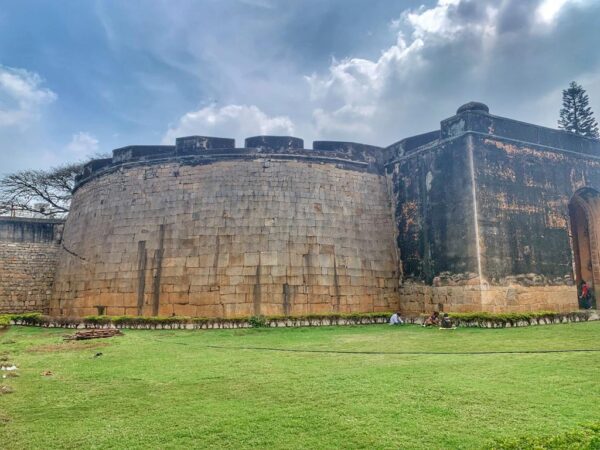
The image size is (600, 450). I want to click on moldy wall, so click(x=493, y=184), click(x=19, y=233).